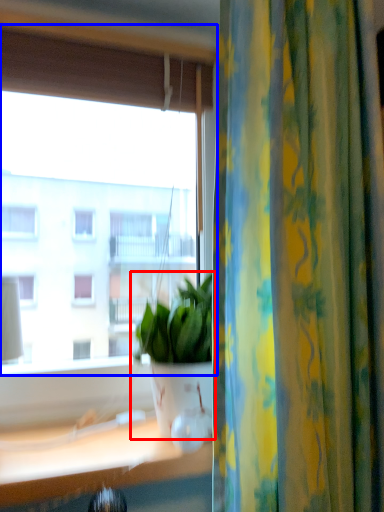
Question: Among these objects, which one is farthest to the camera, houseplant (highlighted by a red box) or window (highlighted by a blue box)?

Choices:
 (A) houseplant
 (B) window

Answer: (B)